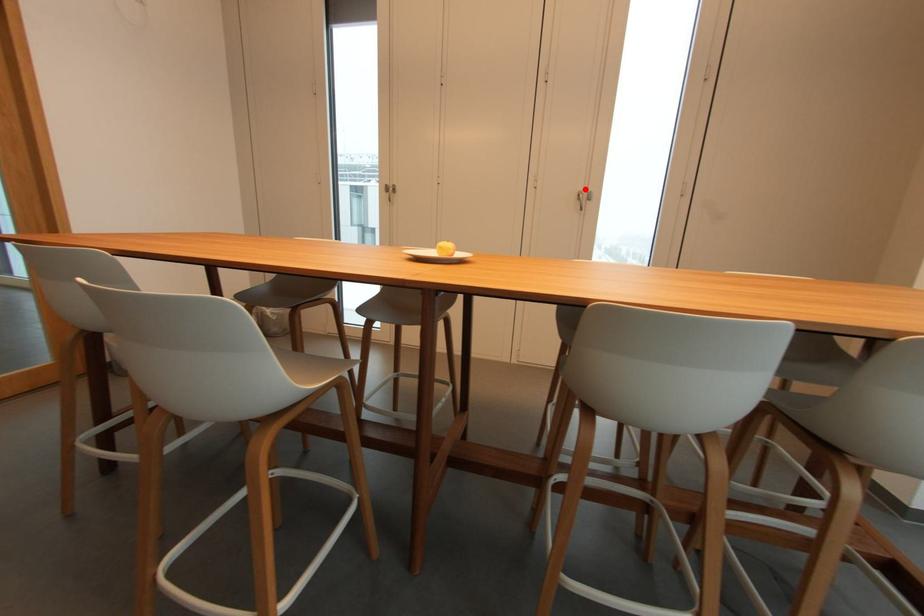
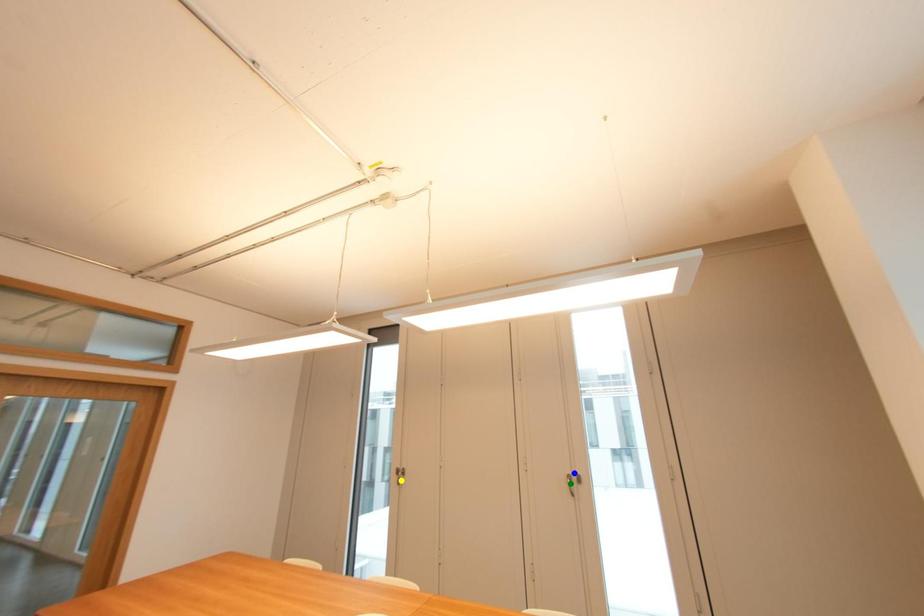
Question: I am providing you with two images of the same scene from different viewpoints. A red point is marked on the first image. You are given multiple points on the second image. Which spot in image 2 lines up with the point in image 1?

Choices:
 (A) yellow point
 (B) green point
 (C) blue point

Answer: (C)